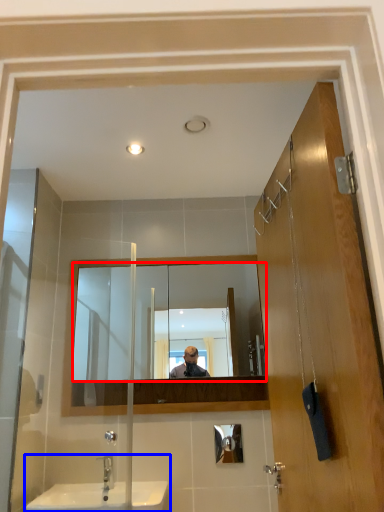
Question: Which object is further to the camera taking this photo, mirror (highlighted by a red box) or sink (highlighted by a blue box)?

Choices:
 (A) mirror
 (B) sink

Answer: (A)